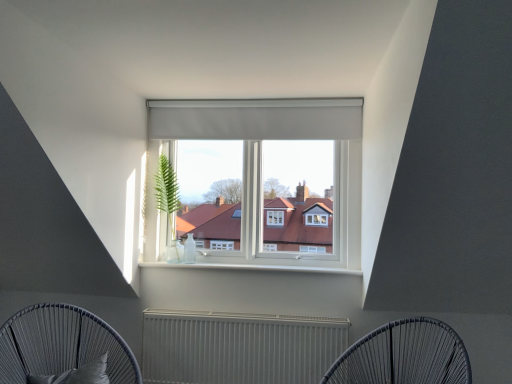
Question: From a real-world perspective, is metallic radiator at center above or below matte gray curtain at center?

Choices:
 (A) below
 (B) above

Answer: (A)

Question: From the image's perspective, is metallic radiator at center above or below matte gray curtain at center?

Choices:
 (A) above
 (B) below

Answer: (B)

Question: Estimate the real-world distances between objects in this image. Which object is closer to the black fabric pillow at lower left?

Choices:
 (A) metallic radiator at center
 (B) metallic wire chair at lower center, placed as the second furniture when sorted from left to right
 (C) dark grey woven chair at lower left, which appears as the second furniture when viewed from the right
 (D) green leafy plant at center
 (E) matte gray curtain at center

Answer: (C)

Question: Based on their relative distances, which object is nearer to the dark grey woven chair at lower left, which ranks as the first furniture in left-to-right order?

Choices:
 (A) matte gray curtain at center
 (B) green leafy plant at center
 (C) metallic wire chair at lower center, placed as the second furniture when sorted from left to right
 (D) metallic radiator at center
 (E) black fabric pillow at lower left

Answer: (E)